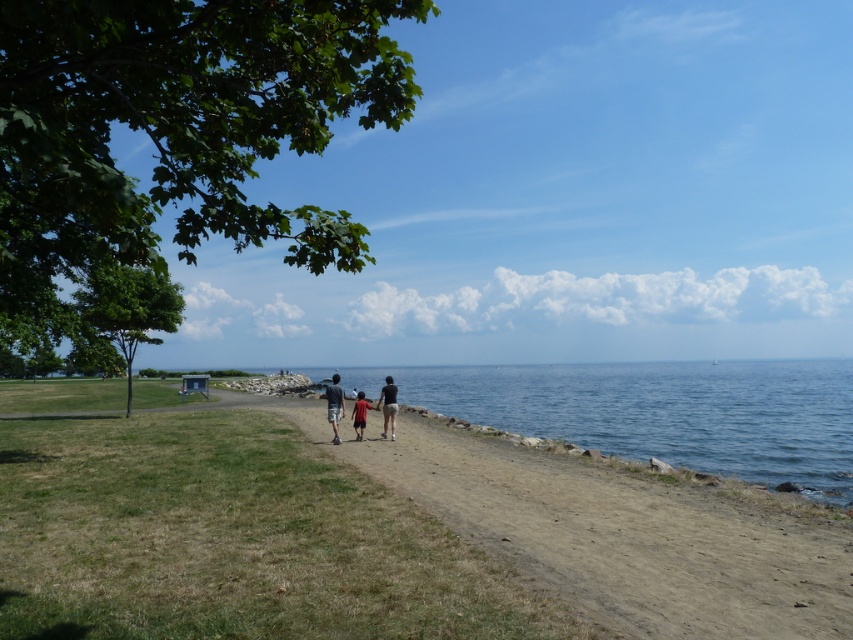
You are a photographer standing at the lakeside and want to capture a photo of the dark gray shorts at center and the red cotton shirt at center in the same frame. Your camera has a maximum focus range that can capture objects up to 5 meters apart. Will you be able to include both in the photo?

The dark gray shorts at center and the red cotton shirt at center are 4.45 meters apart, which is within the camera maximum focus range of 5 meters. Therefore, both can be captured in the same frame.

You are standing at point (366,401) and want to walk to the small sailboat in the distance. Which direction should you move relative to point (386,419)?

You should move towards point (386,419) because it is in front of point (366,401), so moving towards it would be the direction towards the small sailboat in the distance.